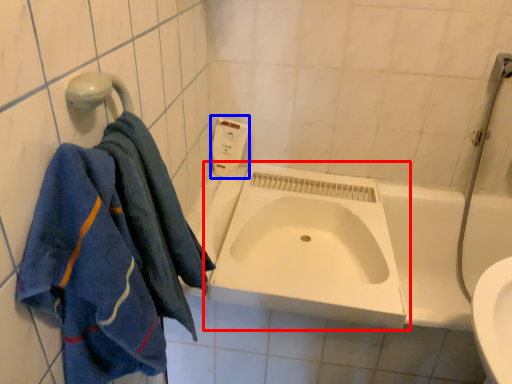
Question: Which object is further to the camera taking this photo, sink (highlighted by a red box) or soap dispenser (highlighted by a blue box)?

Choices:
 (A) sink
 (B) soap dispenser

Answer: (B)